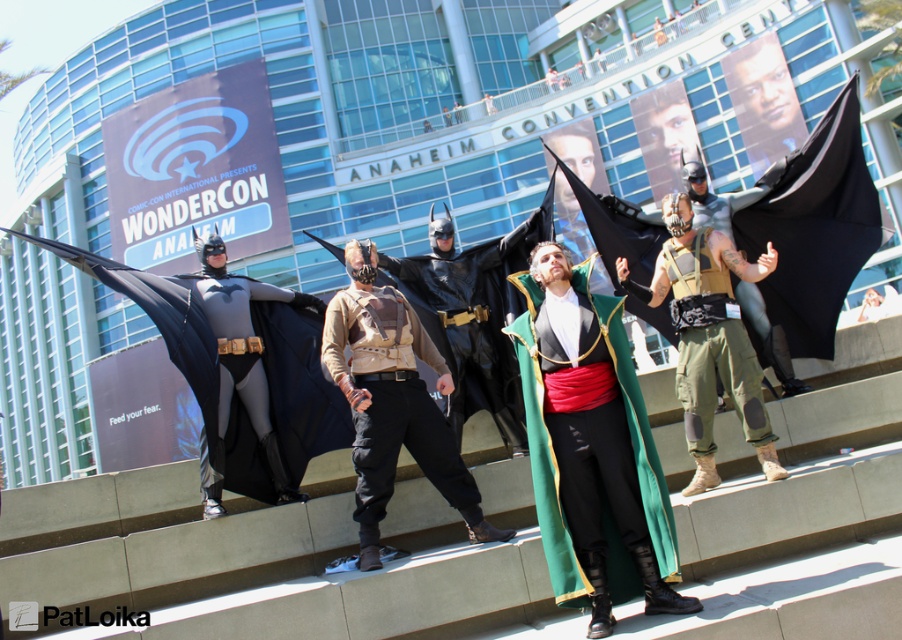
You are standing at the entrance of the convention center and see the green velvet cape at center. If you want to take a photo of it from where you are standing, will you be able to capture the entire cape in the frame without moving closer?

The green velvet cape at center is 13.76 meters away from the viewer. Since it is quite far, you might need a zoom lens or move closer to ensure the entire cape fits in the photo.